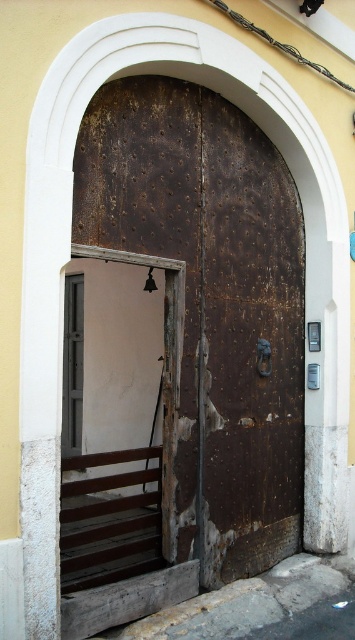
Question: Which object appears farthest from the camera in this image?

Choices:
 (A) brown wooden slats at lower left
 (B) metallic gray door at left
 (C) rusty metal door at center

Answer: (B)

Question: Is rusty metal door at center bigger than metallic gray door at left?

Choices:
 (A) no
 (B) yes

Answer: (B)

Question: Can you confirm if rusty metal door at center is positioned below brown wooden slats at lower left?

Choices:
 (A) no
 (B) yes

Answer: (A)

Question: Which object is closer to the camera taking this photo?

Choices:
 (A) rusty metal door at center
 (B) metallic gray door at left

Answer: (A)

Question: Does rusty metal door at center have a lesser width compared to brown wooden slats at lower left?

Choices:
 (A) no
 (B) yes

Answer: (A)

Question: Estimate the real-world distances between objects in this image. Which object is farther from the rusty metal door at center?

Choices:
 (A) metallic gray door at left
 (B) brown wooden slats at lower left

Answer: (A)